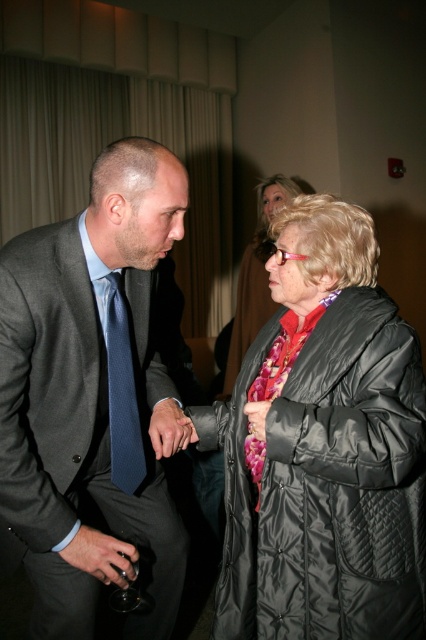
Question: Among these points, which one is farthest from the camera?

Choices:
 (A) (89, 538)
 (B) (135, 250)
 (C) (160, 445)

Answer: (C)

Question: Considering the relative positions of black quilted coat at center and pink satin handbag at lower center in the image provided, where is black quilted coat at center located with respect to pink satin handbag at lower center?

Choices:
 (A) left
 (B) right

Answer: (B)

Question: Which point is farther to the camera?

Choices:
 (A) matte blue tie at left
 (B) matte black hand at center
 (C) dark gray suit at center

Answer: (B)

Question: Is black quilted coat at center wider than matte blue tie at left?

Choices:
 (A) no
 (B) yes

Answer: (B)

Question: Which of the following is the farthest from the observer?

Choices:
 (A) dark gray suit at center
 (B) matte blue tie at left
 (C) shiny black coat at center
 (D) matte black hand at center

Answer: (C)

Question: Is matte blue tie at left to the left of matte black wine glass at lower left from the viewer's perspective?

Choices:
 (A) yes
 (B) no

Answer: (B)